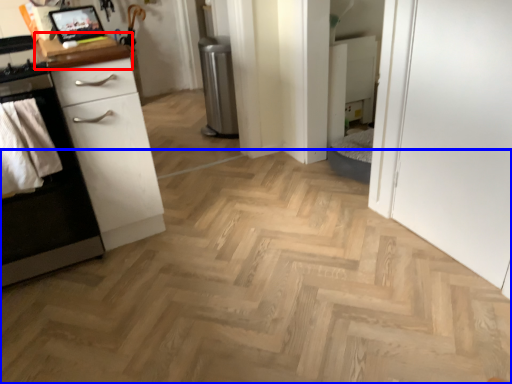
Question: Which object appears closest to the camera in this image, counter top (highlighted by a red box) or plain (highlighted by a blue box)?

Choices:
 (A) counter top
 (B) plain

Answer: (B)